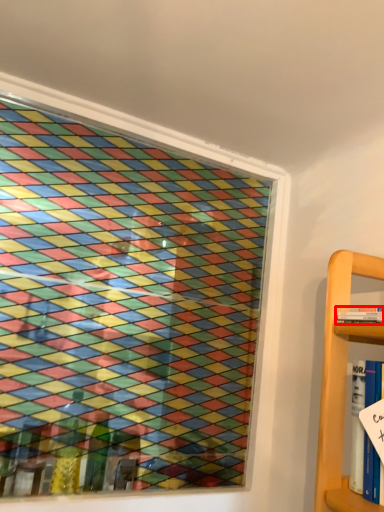
Question: From the image's perspective, what is the correct spatial relationship of book (annotated by the red box) in relation to book?

Choices:
 (A) above
 (B) below

Answer: (A)